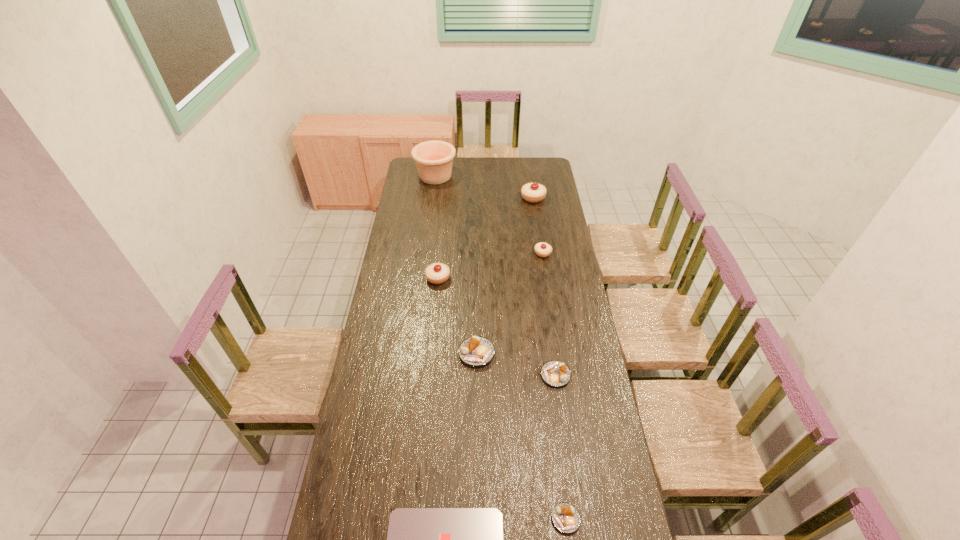
You are a GUI agent. You are given a task and a screenshot of the screen. Output one action in this format:
    pyautogui.click(x=<x>, y=<y>)
    Task: Click on the farthest object
    This screenshot has height=540, width=960.
    Given the screenshot: What is the action you would take?
    pyautogui.click(x=434, y=159)

The height and width of the screenshot is (540, 960). What are the coordinates of `the tallest object` in the screenshot? It's located at (434, 159).

Where is `the second farthest object`? The image size is (960, 540). the second farthest object is located at coordinates (533, 192).

Locate an element on the screen. the biggest beige pastry is located at coordinates (533, 192).

Where is `the second smallest beige pastry`? The height and width of the screenshot is (540, 960). the second smallest beige pastry is located at coordinates (437, 273).

Where is `the nearest beige pastry`? The width and height of the screenshot is (960, 540). the nearest beige pastry is located at coordinates (437, 273).

This screenshot has height=540, width=960. I want to click on the fifth shortest object, so click(x=542, y=249).

Identify the location of the second farthest pastry. pos(542,249).

Identify the location of the fifth tallest object. (476, 351).

Where is `the leftmost brown pastry`? This screenshot has width=960, height=540. the leftmost brown pastry is located at coordinates (476, 351).